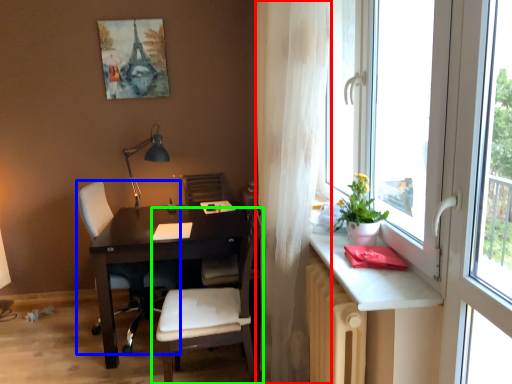
Question: Based on their relative distances, which object is farther from curtain (highlighted by a red box)? Choose from chair (highlighted by a blue box) and chair (highlighted by a green box).

Choices:
 (A) chair
 (B) chair

Answer: (A)